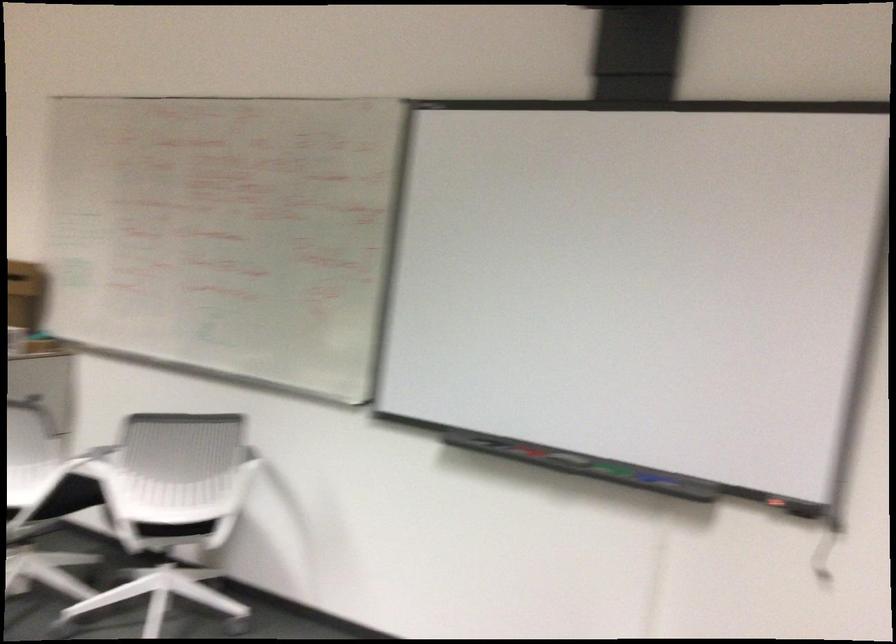
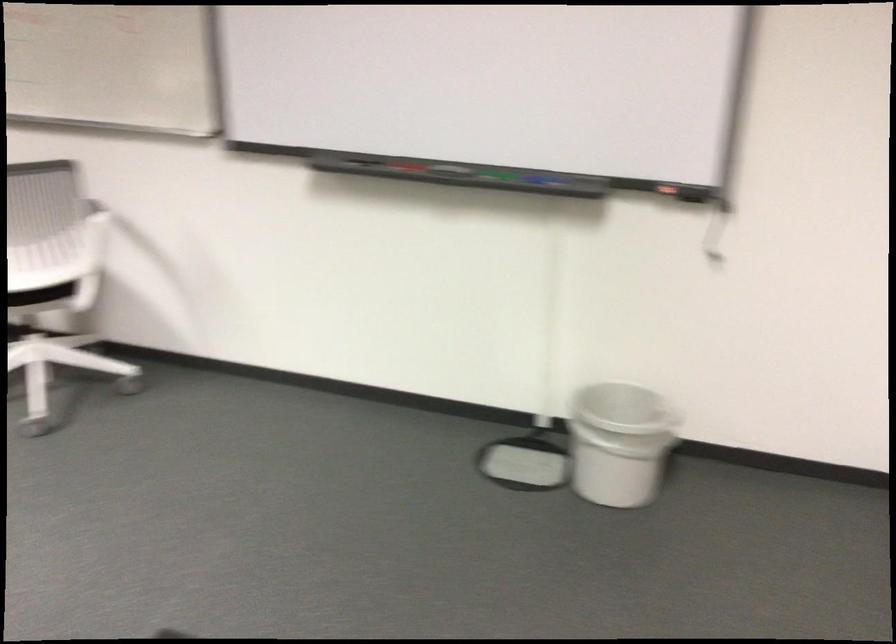
Where in the second image is the point corresponding to point 608,469 from the first image?

(492, 176)